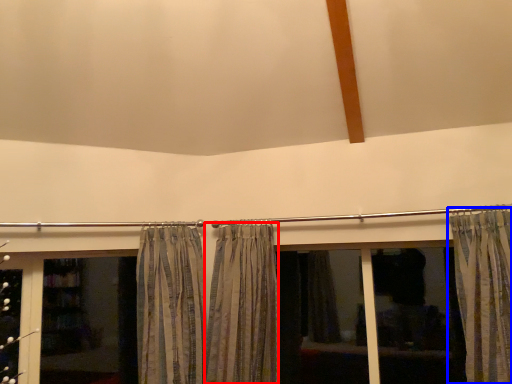
Question: Which point is further to the camera, curtain (highlighted by a red box) or curtain (highlighted by a blue box)?

Choices:
 (A) curtain
 (B) curtain

Answer: (A)